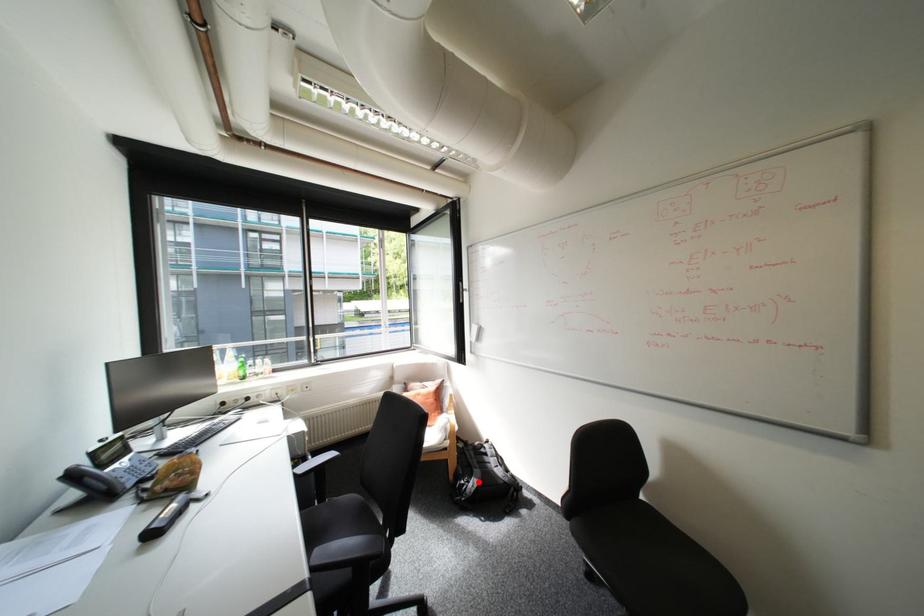
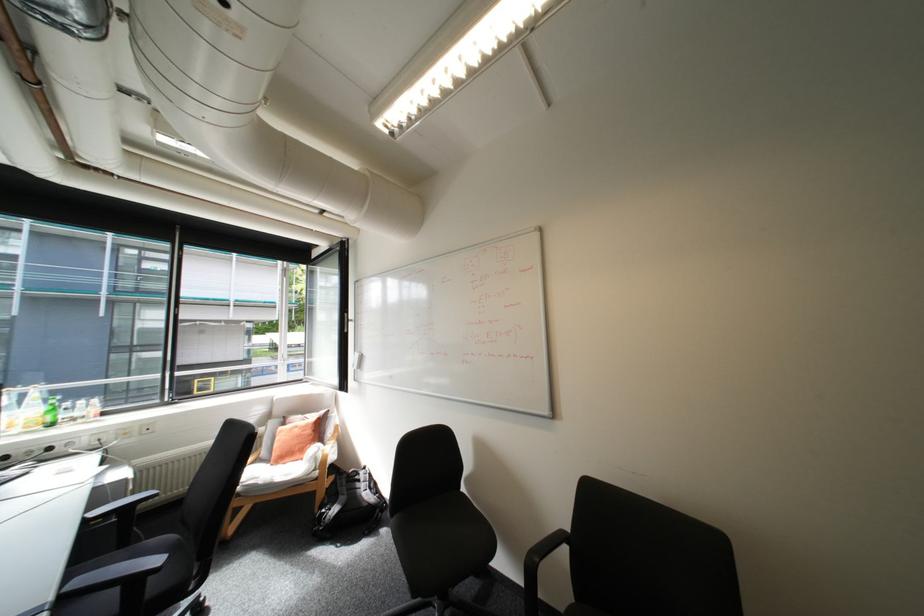
Question: I am providing you with two images of the same scene from different viewpoints. Given a red point in image1, look at the same physical point in image2. Is it:

Choices:
 (A) Closer to the viewpoint
 (B) Farther from the viewpoint

Answer: (A)